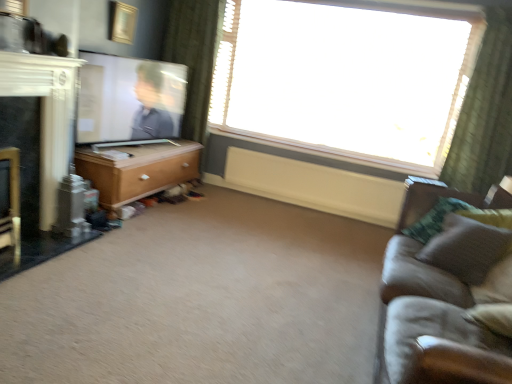
Question: From a real-world perspective, is wooden chest of drawers at left positioned under green textured pillow at right based on gravity?

Choices:
 (A) no
 (B) yes

Answer: (B)

Question: Is wooden chest of drawers at left not within green textured pillow at right?

Choices:
 (A) yes
 (B) no

Answer: (A)

Question: Is wooden chest of drawers at left shorter than green textured pillow at right?

Choices:
 (A) no
 (B) yes

Answer: (A)

Question: Is wooden chest of drawers at left taller than green textured pillow at right?

Choices:
 (A) no
 (B) yes

Answer: (B)

Question: Is wooden chest of drawers at left thinner than green textured pillow at right?

Choices:
 (A) yes
 (B) no

Answer: (B)

Question: Are wooden chest of drawers at left and green textured pillow at right beside each other?

Choices:
 (A) no
 (B) yes

Answer: (A)

Question: Is suede gray couch at right closer to the viewer compared to gold metallic picture frame at upper center?

Choices:
 (A) yes
 (B) no

Answer: (A)

Question: Is suede gray couch at right aimed at gold metallic picture frame at upper center?

Choices:
 (A) no
 (B) yes

Answer: (A)

Question: From the image's perspective, is suede gray couch at right under gold metallic picture frame at upper center?

Choices:
 (A) no
 (B) yes

Answer: (B)

Question: Are suede gray couch at right and gold metallic picture frame at upper center far apart?

Choices:
 (A) yes
 (B) no

Answer: (A)

Question: From a real-world perspective, is suede gray couch at right on gold metallic picture frame at upper center?

Choices:
 (A) yes
 (B) no

Answer: (B)

Question: Is suede gray couch at right at the left side of gold metallic picture frame at upper center?

Choices:
 (A) yes
 (B) no

Answer: (B)

Question: Is suede gray couch at right beside wooden chest of drawers at left?

Choices:
 (A) yes
 (B) no

Answer: (B)